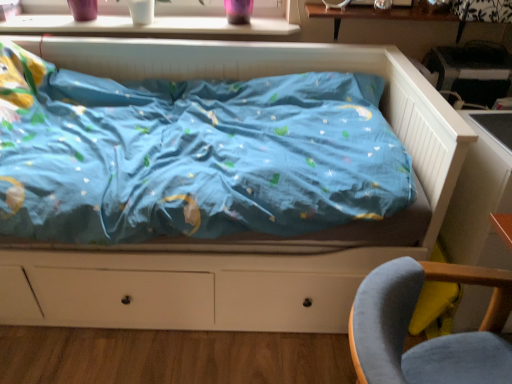
The width and height of the screenshot is (512, 384). I want to click on vacant area on top of white glossy window sill at upper center (from a real-world perspective), so click(160, 20).